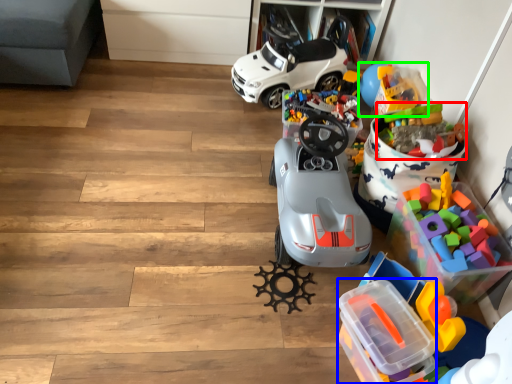
Question: Estimate the real-world distances between objects in this image. Which object is farther from toy (highlighted by a red box), storage box (highlighted by a blue box) or toy (highlighted by a green box)?

Choices:
 (A) storage box
 (B) toy

Answer: (A)